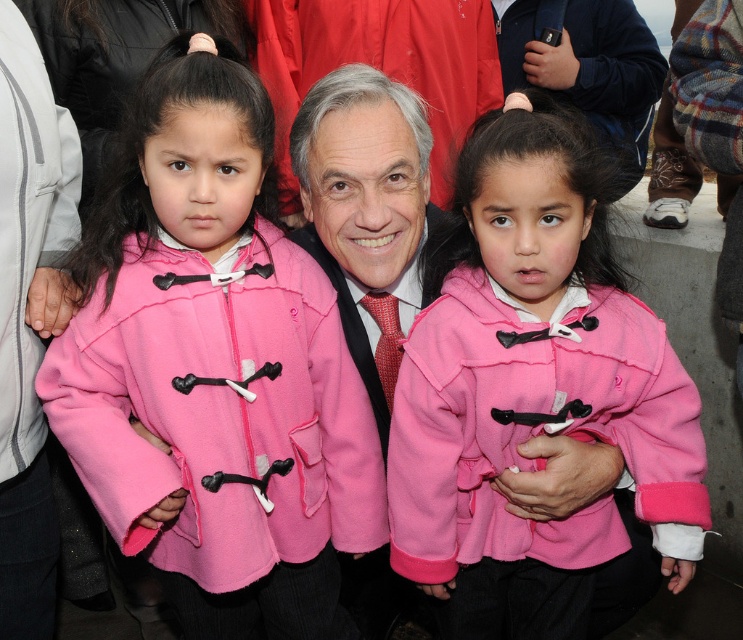
Is point (162, 140) positioned before point (386, 387)?

Yes, point (162, 140) is in front of point (386, 387).

Is matte pink coat at left positioned behind polka dot silk tie at center?

That is False.

Image resolution: width=743 pixels, height=640 pixels. In order to click on matte pink coat at left in this screenshot , I will do point(215,371).

Which is more to the right, pink fleece jacket at center or matte pink jacket at center?

From the viewer's perspective, pink fleece jacket at center appears more on the right side.

Does point (658, 410) come farther from viewer compared to point (435, 61)?

That is False.

Which is behind, point (551, 333) or point (288, 26)?

The point (288, 26) is behind.

Where is `pink fleece jacket at center`? The height and width of the screenshot is (640, 743). pink fleece jacket at center is located at coordinates (533, 388).

Is matte pink coat at left wider than matte pink jacket at center?

Incorrect, matte pink coat at left's width does not surpass matte pink jacket at center's.

Is point (146, 134) in front of point (431, 157)?

That is True.

This screenshot has width=743, height=640. I want to click on matte pink coat at left, so click(x=215, y=371).